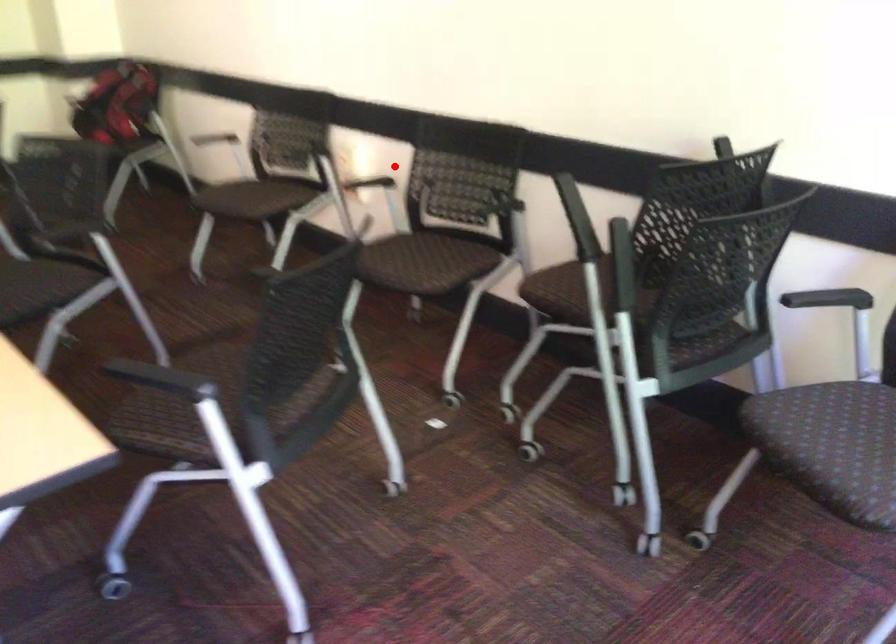
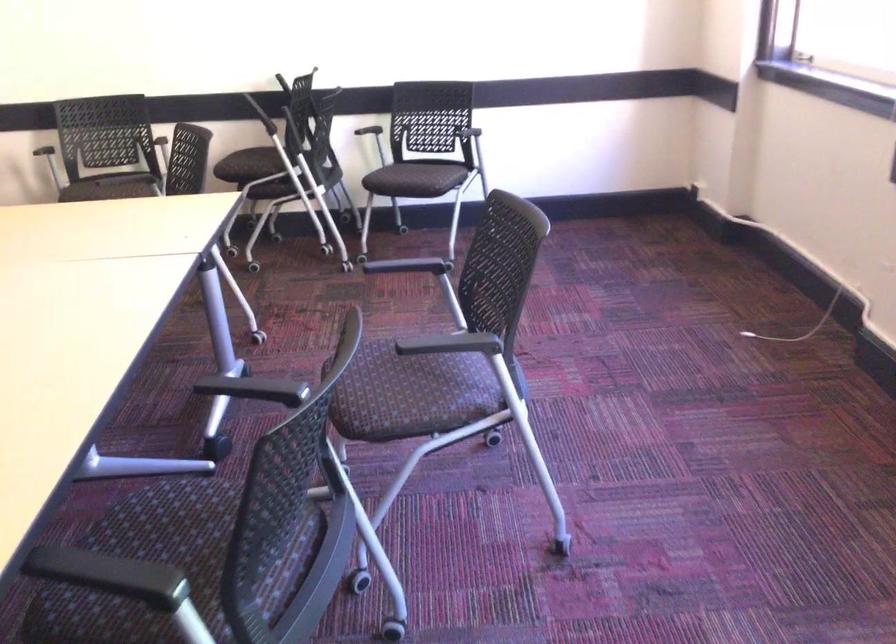
Question: A red point is marked in image1. In image2, is the corresponding 3D point closer to the camera or farther? Reply with the corresponding letter.

Choices:
 (A) The corresponding 3D point is closer.
 (B) The corresponding 3D point is farther.

Answer: (B)